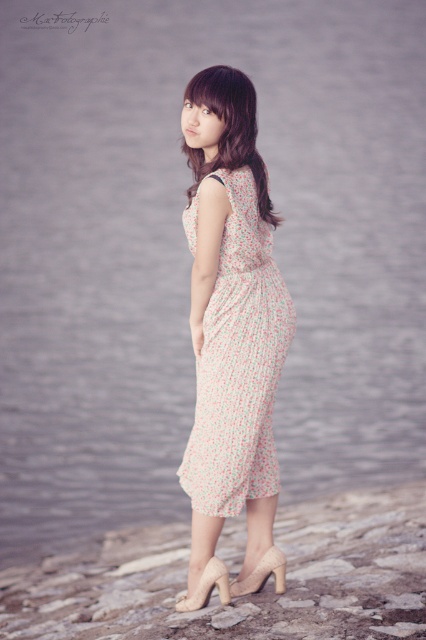
You are a photographer trying to capture the floral chiffon dress at center. The camera is focused at point (238, 364). Is the point on the dress?

Yes, the point (238, 364) is on the floral chiffon dress at center, so the camera is focused on the dress.

You are a photographer trying to capture the floral chiffon dress at center in the image. If the camera is positioned at the origin point, what are the coordinates of the dress?

The coordinates of the floral chiffon dress at center are at point (238, 364).